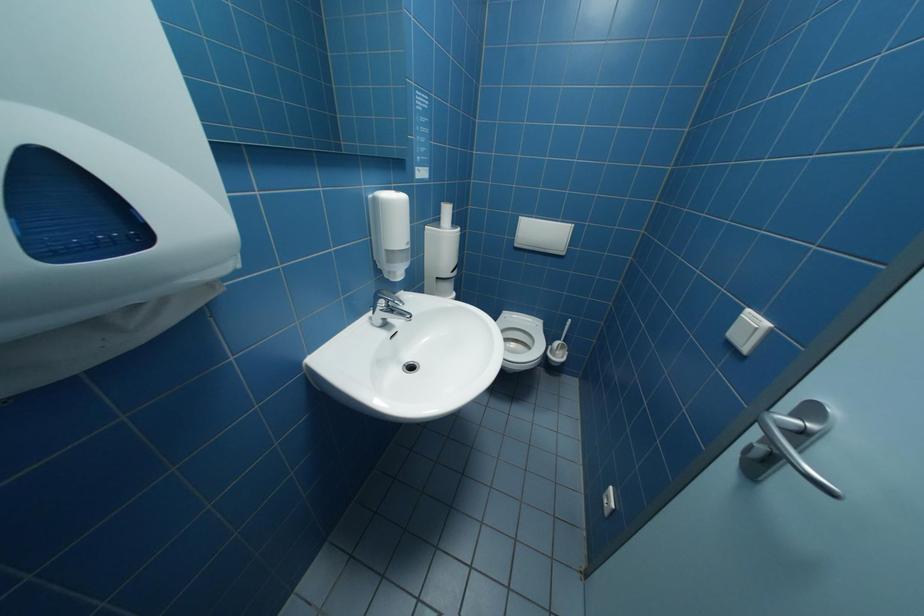
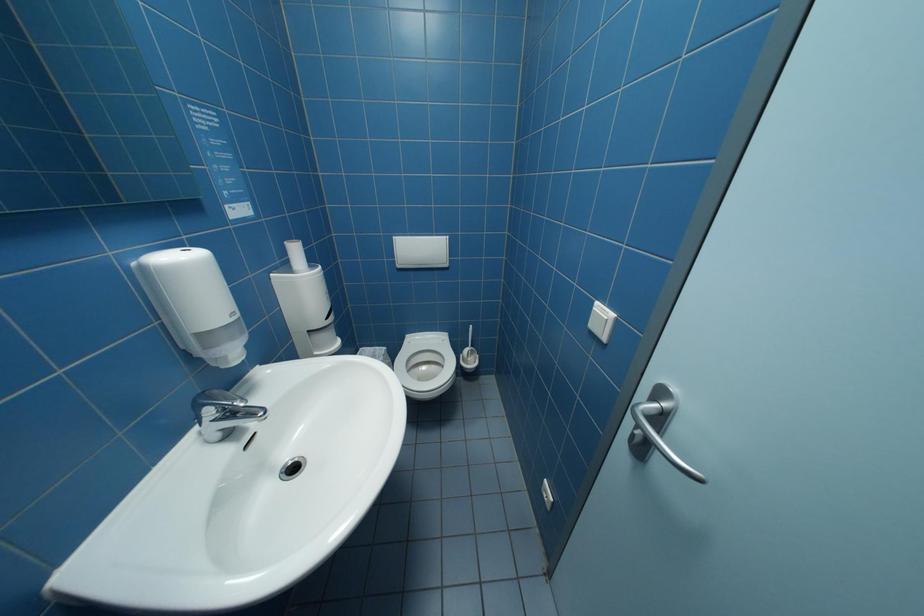
Question: The camera is either moving clockwise (left) or counter-clockwise (right) around the object. The first image is from the beginning of the video and the second image is from the end. Is the camera moving left or right when shooting the video?

Choices:
 (A) Left
 (B) Right

Answer: (A)